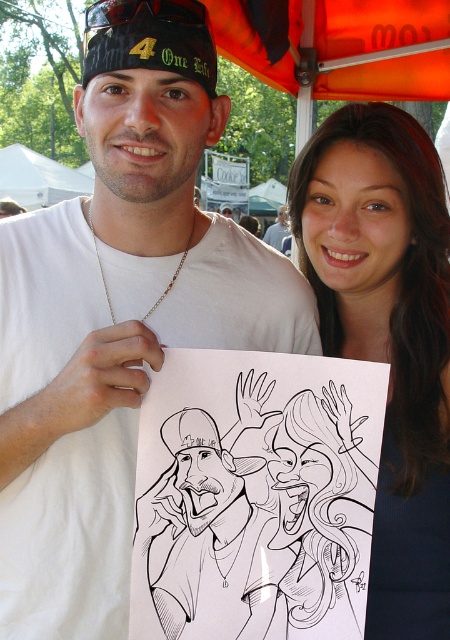
You are an artist trying to sketch this scene. You need to decide the size of the elements. Which one should you draw smaller between the smooth dark hair at center and the orange fabric canopy at upper center?

The smooth dark hair at center should be drawn smaller than the orange fabric canopy at upper center because it is smaller in size according to the description.